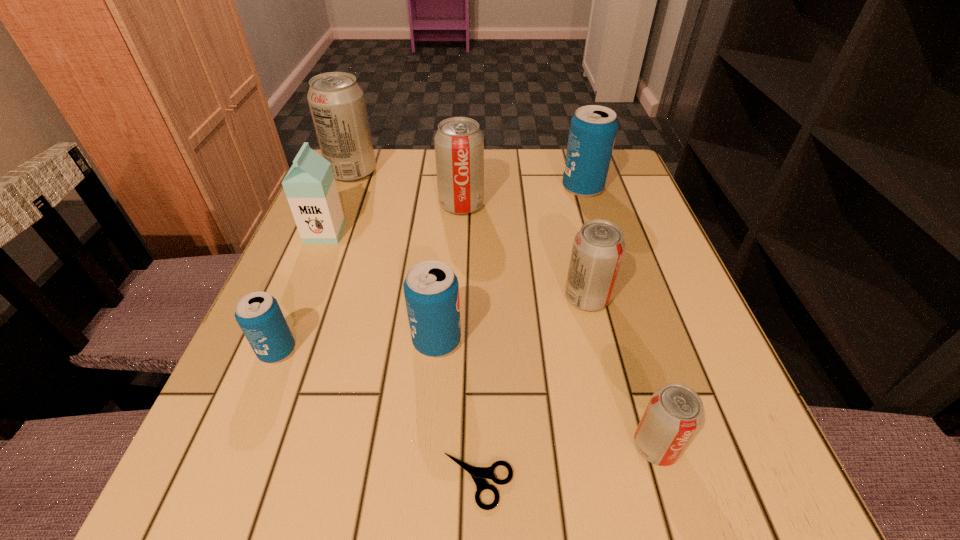
Where is `vacant space located on the right of the second smallest blue soda can`? This screenshot has width=960, height=540. vacant space located on the right of the second smallest blue soda can is located at coordinates (526, 341).

In order to click on free space located 0.220m on the back of the smallest blue soda can in this screenshot , I will do `click(317, 252)`.

At what (x,y) coordinates should I click in order to perform the action: click on vacant space situated 0.050m on the left of the nearest gray soda can. Please return your answer as a coordinate pair (x, y). The width and height of the screenshot is (960, 540). Looking at the image, I should click on (597, 446).

The width and height of the screenshot is (960, 540). I want to click on free space located 0.180m on the left of the shortest object, so click(x=305, y=481).

Locate an element on the screen. Image resolution: width=960 pixels, height=540 pixels. soda can that is at the near edge is located at coordinates [x=674, y=413].

Where is `shears positioned at the near edge`? The width and height of the screenshot is (960, 540). shears positioned at the near edge is located at coordinates (479, 474).

This screenshot has width=960, height=540. In order to click on milk carton that is positioned at the left edge in this screenshot , I will do `click(310, 187)`.

Where is `object located at the far left corner`? This screenshot has height=540, width=960. object located at the far left corner is located at coordinates (337, 103).

The width and height of the screenshot is (960, 540). I want to click on object that is at the far right corner, so click(x=593, y=128).

The image size is (960, 540). I want to click on object that is at the near right corner, so click(674, 413).